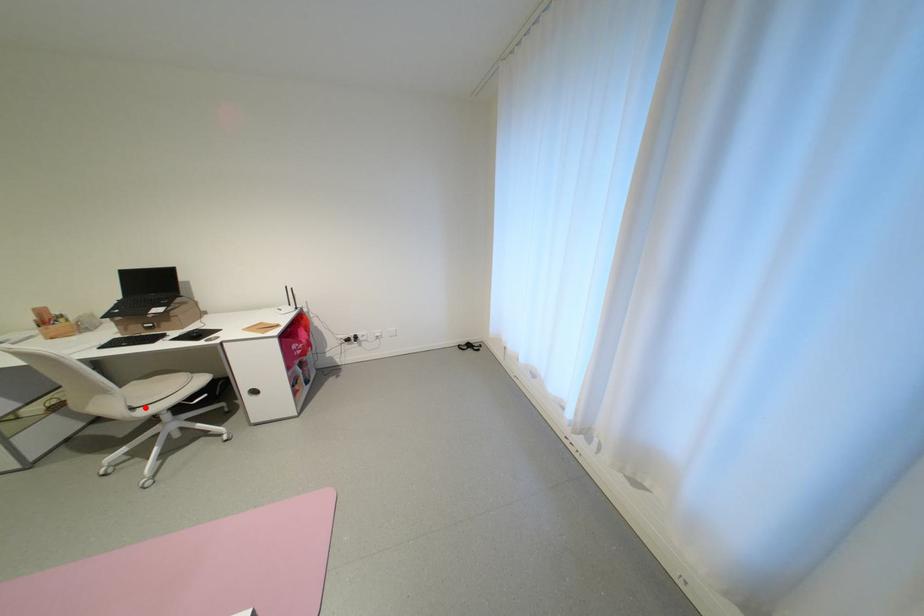
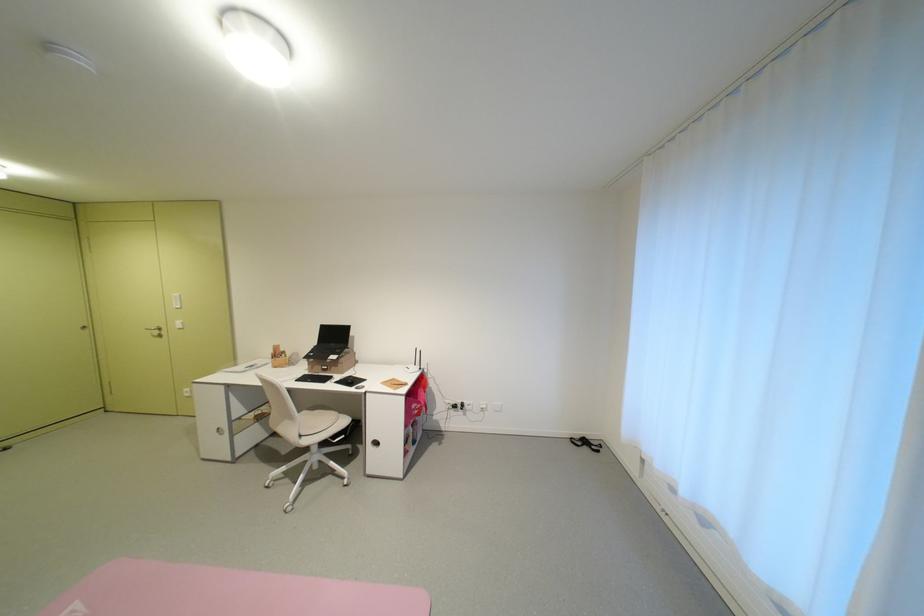
The point at the highlighted location is marked in the first image. Where is the corresponding point in the second image?

(311, 436)